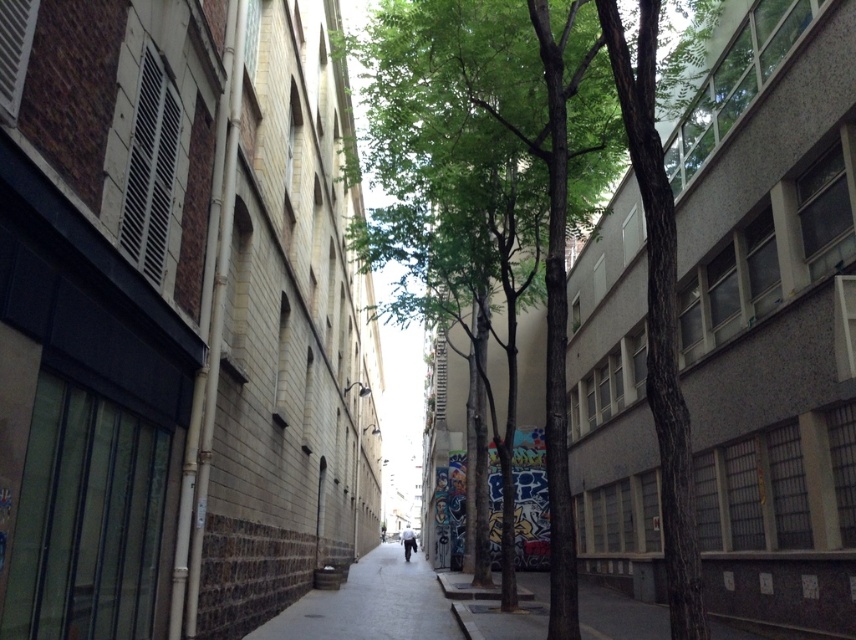
You are a delivery drone flying above an urban alleyway. You need to navigate between two points marked as point (337,605) and point (414,550). Which point is closer to you when viewed from above?

Point (337,605) is in front of point (414,550), so it is closer to you when viewed from above.

You are a pedestrian standing at the entrance of the alleyway. You see the green rough bark tree at center and the gray concrete sidewalk at center. Which object is closer to you?

The green rough bark tree at center is closer to the viewer than the gray concrete sidewalk at center.

Looking at this image, you are a delivery person with a 1.2 meter wide cart. You need to navigate through the narrow alleyway. The alleyway has a green rough bark tree at center and a gray concrete sidewalk at center. Can your cart pass through the narrowest point between them?

The green rough bark tree at center is wider than the gray concrete sidewalk at center, so the narrowest point between them is the width of the gray concrete sidewalk at center. Since the gray concrete sidewalk at center is narrower than the tree, the cart might not fit if the sidewalk is too narrow. However, the exact width isn